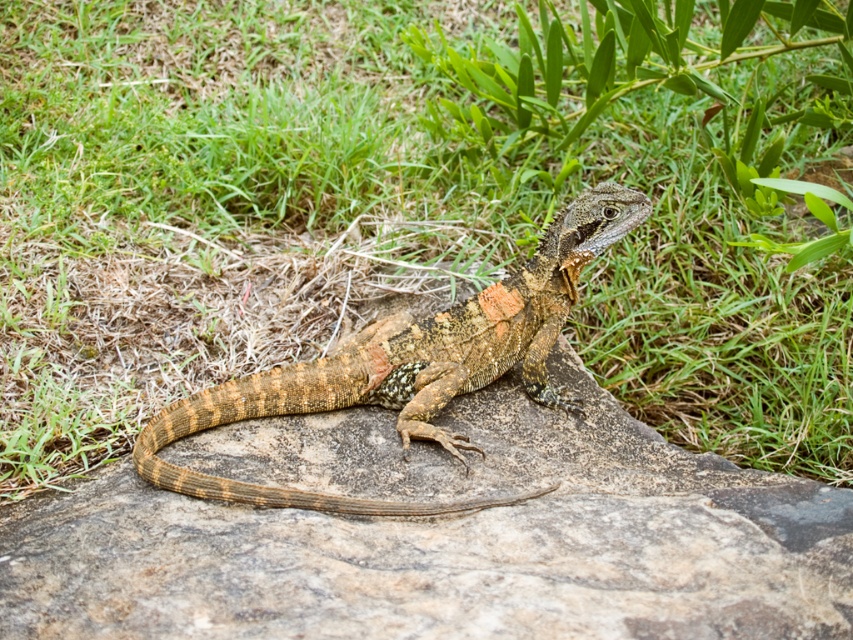
Question: Can you confirm if brown rough stone at center is positioned to the left of speckled brown lizard at center?

Choices:
 (A) yes
 (B) no

Answer: (B)

Question: Can you confirm if brown rough stone at center is smaller than speckled brown lizard at center?

Choices:
 (A) yes
 (B) no

Answer: (B)

Question: Can you confirm if brown rough stone at center is positioned above speckled brown lizard at center?

Choices:
 (A) no
 (B) yes

Answer: (A)